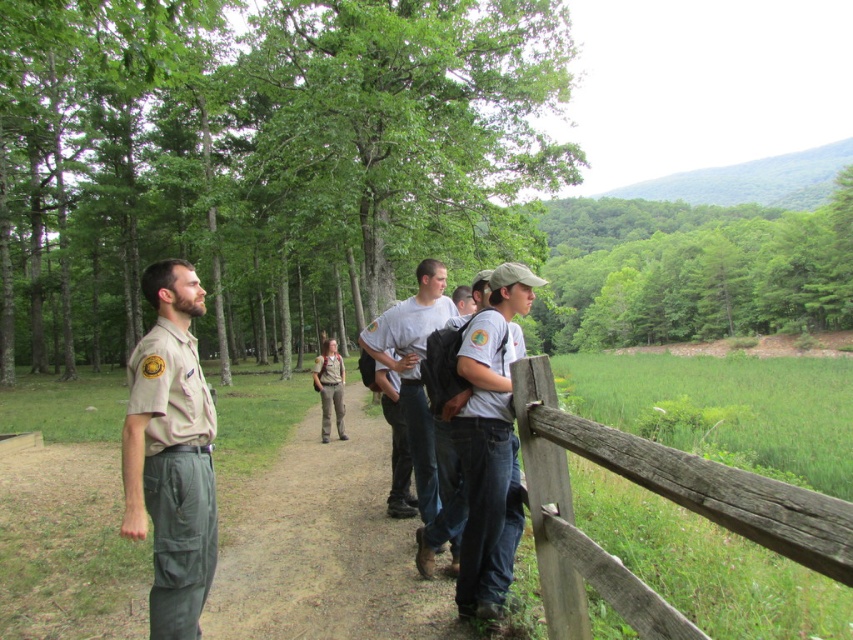
Question: Which of the following is the farthest from the observer?

Choices:
 (A) light gray t-shirt at center
 (B) white cotton shirt at center
 (C) weathered wood fence at lower right

Answer: (A)

Question: Among these objects, which one is nearest to the camera?

Choices:
 (A) light gray t-shirt at center
 (B) tan uniform at center
 (C) brown uniform at center
 (D) weathered wood fence at lower right

Answer: (D)

Question: Is white cotton shirt at center in front of brown uniform at center?

Choices:
 (A) yes
 (B) no

Answer: (A)

Question: Is white cotton shirt at center to the left of brown uniform at center from the viewer's perspective?

Choices:
 (A) yes
 (B) no

Answer: (B)

Question: Which of the following is the farthest from the observer?

Choices:
 (A) (466, 340)
 (B) (421, 392)

Answer: (B)

Question: Can you confirm if weathered wood fence at lower right is positioned above white cotton shirt at center?

Choices:
 (A) no
 (B) yes

Answer: (B)